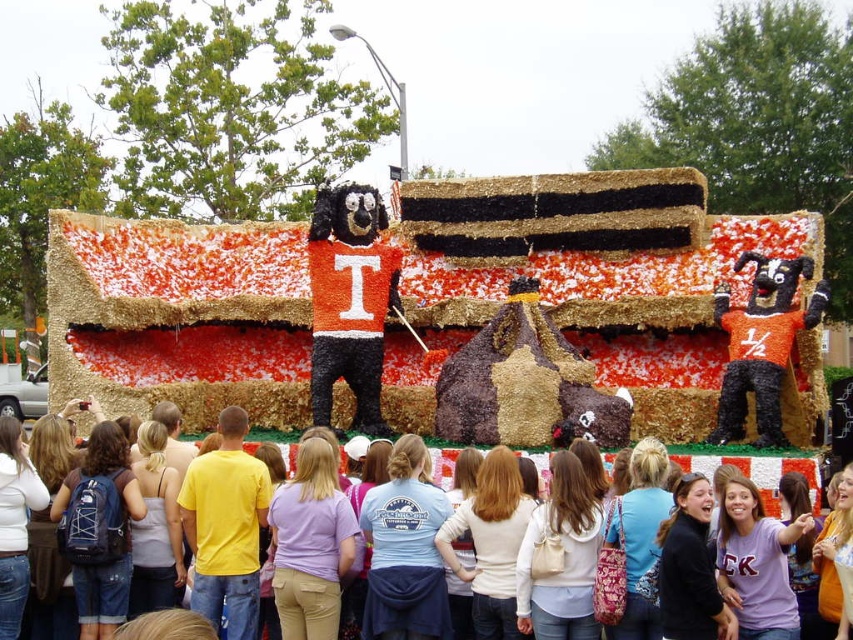
Between point (239, 545) and point (543, 464), which one is positioned behind?

Positioned behind is point (543, 464).

Can you confirm if yellow t-shirt at center is thinner than light blue t-shirt at center?

Yes, yellow t-shirt at center is thinner than light blue t-shirt at center.

Measure the distance between yellow t-shirt at center and camera.

189.66 feet

Where is `yellow t-shirt at center`? The height and width of the screenshot is (640, 853). yellow t-shirt at center is located at coordinates pos(225,528).